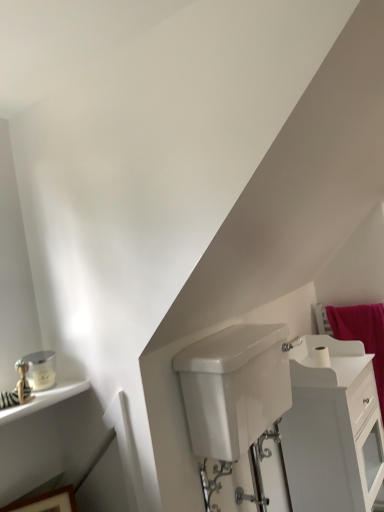
Question: Is wooden picture frame at lower left facing towards pink fabric bath towel at right?

Choices:
 (A) yes
 (B) no

Answer: (B)

Question: Can you confirm if wooden picture frame at lower left is positioned to the right of pink fabric bath towel at right?

Choices:
 (A) yes
 (B) no

Answer: (B)

Question: Is wooden picture frame at lower left not inside pink fabric bath towel at right?

Choices:
 (A) no
 (B) yes

Answer: (B)

Question: Does wooden picture frame at lower left appear on the left side of pink fabric bath towel at right?

Choices:
 (A) yes
 (B) no

Answer: (A)

Question: Does wooden picture frame at lower left have a larger size compared to pink fabric bath towel at right?

Choices:
 (A) yes
 (B) no

Answer: (B)

Question: Does wooden picture frame at lower left have a lesser height compared to pink fabric bath towel at right?

Choices:
 (A) no
 (B) yes

Answer: (B)

Question: Is white glossy cabinet at lower right far away from white glossy tank at lower center?

Choices:
 (A) no
 (B) yes

Answer: (A)

Question: Is white glossy cabinet at lower right smaller than white glossy tank at lower center?

Choices:
 (A) yes
 (B) no

Answer: (B)

Question: Is white glossy cabinet at lower right thinner than white glossy tank at lower center?

Choices:
 (A) yes
 (B) no

Answer: (B)

Question: Considering the relative positions of white glossy cabinet at lower right and white glossy tank at lower center in the image provided, is white glossy cabinet at lower right to the right of white glossy tank at lower center from the viewer's perspective?

Choices:
 (A) no
 (B) yes

Answer: (B)

Question: From a real-world perspective, is white glossy cabinet at lower right located higher than white glossy tank at lower center?

Choices:
 (A) yes
 (B) no

Answer: (B)

Question: Is white glossy cabinet at lower right looking in the opposite direction of white glossy tank at lower center?

Choices:
 (A) yes
 (B) no

Answer: (B)

Question: Are white matte toilet paper at upper right and wooden picture frame at lower left making contact?

Choices:
 (A) no
 (B) yes

Answer: (A)